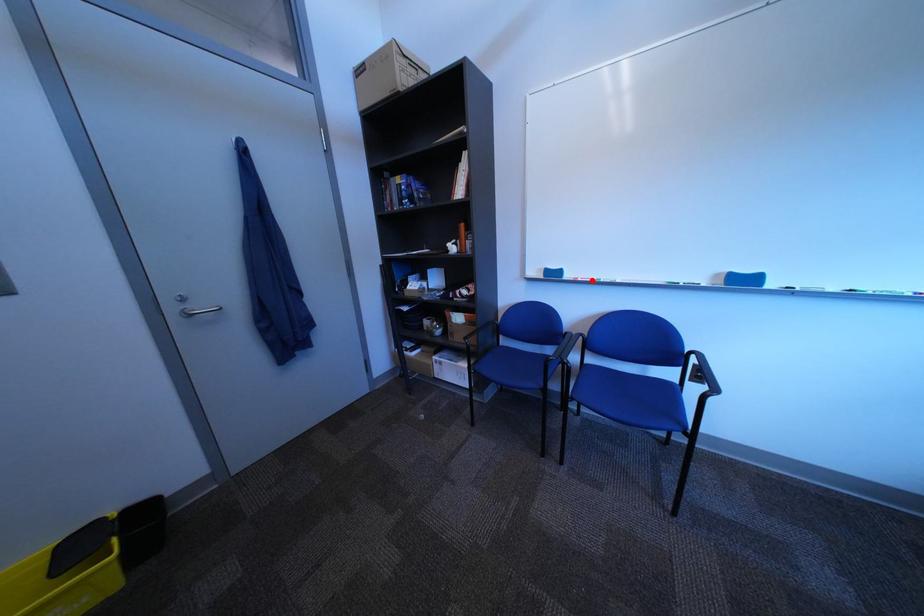
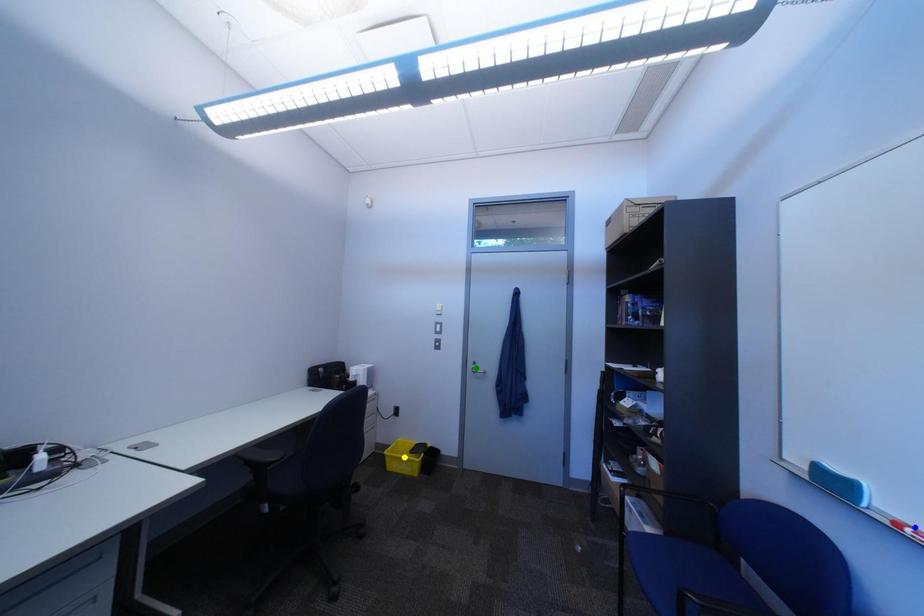
Question: I am providing you with two images of the same scene from different viewpoints. A red point is marked on the first image. You are given multiple points on the second image. Can you choose the point in image 2 that corresponds to the point in image 1?

Choices:
 (A) yellow point
 (B) blue point
 (C) green point

Answer: (B)